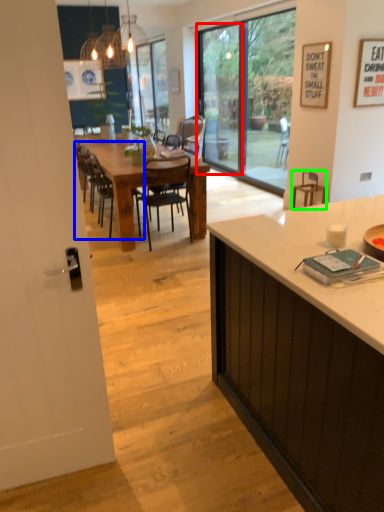
Question: Based on their relative distances, which object is nearer to screen door (highlighted by a red box)? Choose from chair (highlighted by a blue box) and armchair (highlighted by a green box).

Choices:
 (A) chair
 (B) armchair

Answer: (B)